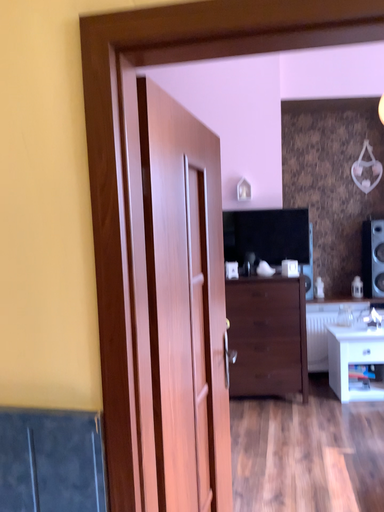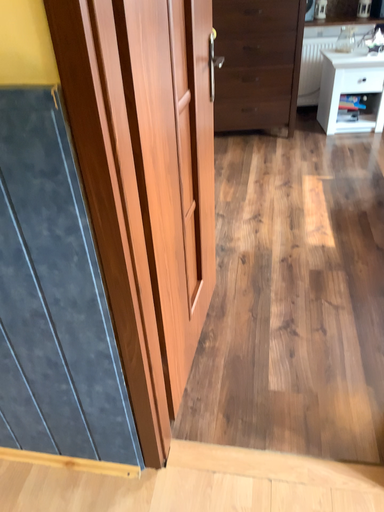
Question: How did the camera likely rotate when shooting the video?

Choices:
 (A) rotated downward
 (B) rotated upward

Answer: (A)